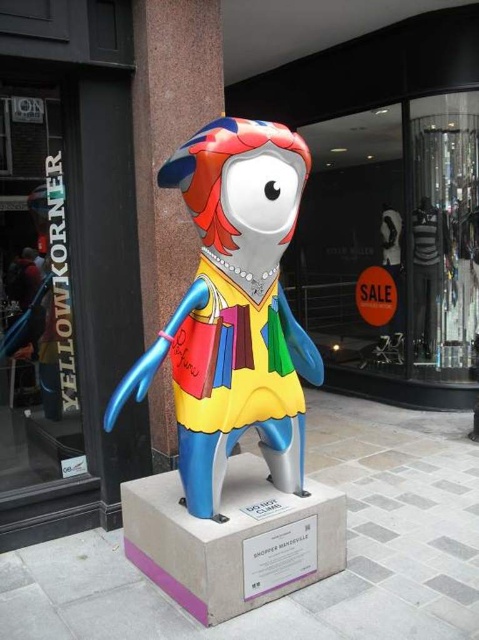
Based on the photo, you are a photographer trying to capture the metallic multicolored statue at center and the clear glass mannequins at center in a single shot. Based on their positions, which object should you place closer to the left edge of your camera frame?

The metallic multicolored statue at center should be placed closer to the left edge of your camera frame because it is positioned on the left side of the clear glass mannequins at center.

You are a delivery person who needs to place a package between the glass display at center and the transparent glass window at left. The package requires 12 feet of space. Is there enough space between them?

The glass display at center is 14.27 feet away from the transparent glass window at left, so yes, there is enough space between them to place the package that requires 12 feet of space.